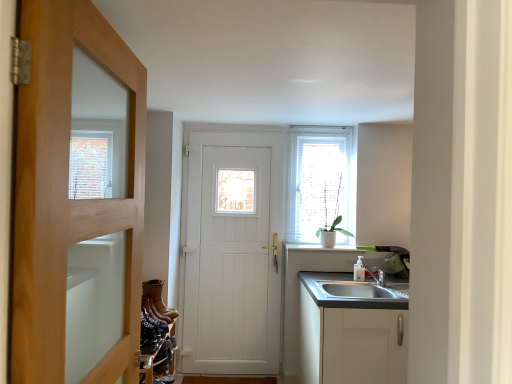
I want to click on blank area beneath white wooden door at center, which appears as the second door when viewed from the front (from a real-world perspective), so click(232, 372).